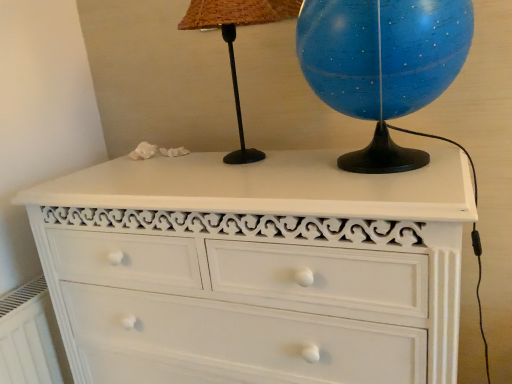
Identify the location of white painted wood chest of drawers at center. The image size is (512, 384). (255, 268).

At what (x,y) coordinates should I click in order to perform the action: click on black matte table lamp at upper center. Please return your answer as a coordinate pair (x, y). Image resolution: width=512 pixels, height=384 pixels. Looking at the image, I should click on (232, 45).

What is the approximate width of black matte table lamp at upper center?

7.16 inches.

Locate an element on the screen. This screenshot has height=384, width=512. white painted wood chest of drawers at center is located at coordinates (255, 268).

Is point (179, 28) less distant than point (440, 79)?

No, (179, 28) is behind (440, 79).

There is a blue glossy globe at upper right. Identify the location of table lamp above it (from a real-world perspective). The width and height of the screenshot is (512, 384). (232, 45).

Would you say black matte table lamp at upper center contains blue glossy globe at upper right?

No, blue glossy globe at upper right is not inside black matte table lamp at upper center.

Consider the image. From the image's perspective, which one is positioned lower, black matte table lamp at upper center or blue glossy globe at upper right?

blue glossy globe at upper right, from the image's perspective.

Between white painted wood chest of drawers at center and black matte table lamp at upper center, which one has larger size?

With larger size is white painted wood chest of drawers at center.

How many degrees apart are the facing directions of white painted wood chest of drawers at center and black matte table lamp at upper center?

0.00374 degrees.

Between white painted wood chest of drawers at center and black matte table lamp at upper center, which one has more height?

white painted wood chest of drawers at center is taller.

Considering the points (426, 344) and (221, 14), which point is behind, point (426, 344) or point (221, 14)?

Positioned behind is point (221, 14).

Considering the positions of objects blue glossy globe at upper right and white painted radiator at lower left in the image provided, who is more to the right, blue glossy globe at upper right or white painted radiator at lower left?

From the viewer's perspective, blue glossy globe at upper right appears more on the right side.

From the image's perspective, is blue glossy globe at upper right located beneath white painted radiator at lower left?

No.

Do you think blue glossy globe at upper right is within white painted radiator at lower left, or outside of it?

blue glossy globe at upper right is outside white painted radiator at lower left.

Between blue glossy globe at upper right and white painted radiator at lower left, which one has smaller size?

white painted radiator at lower left is smaller.

From the image's perspective, which one is positioned higher, white painted radiator at lower left or black matte table lamp at upper center?

black matte table lamp at upper center is shown above in the image.

Does white painted radiator at lower left turn towards black matte table lamp at upper center?

No, white painted radiator at lower left is not facing towards black matte table lamp at upper center.

Between white painted radiator at lower left and black matte table lamp at upper center, which one appears on the left side from the viewer's perspective?

From the viewer's perspective, white painted radiator at lower left appears more on the left side.

Does white painted radiator at lower left have a larger size compared to black matte table lamp at upper center?

No.

In terms of width, does blue glossy globe at upper right look wider or thinner when compared to white painted wood chest of drawers at center?

Considering their sizes, blue glossy globe at upper right looks slimmer than white painted wood chest of drawers at center.

From the image's perspective, is blue glossy globe at upper right located above white painted wood chest of drawers at center?

Yes, from the image's perspective, blue glossy globe at upper right is above white painted wood chest of drawers at center.

Can you tell me how much blue glossy globe at upper right and white painted wood chest of drawers at center differ in facing direction?

They differ by 0.000908 degrees in their facing directions.

Where is `chest of drawers in front of the blue glossy globe at upper right`? chest of drawers in front of the blue glossy globe at upper right is located at coordinates (255, 268).

Is black matte table lamp at upper center oriented away from white painted wood chest of drawers at center?

No.

Would you consider black matte table lamp at upper center to be distant from white painted wood chest of drawers at center?

No, there isn't a large distance between black matte table lamp at upper center and white painted wood chest of drawers at center.

Is black matte table lamp at upper center situated inside white painted wood chest of drawers at center or outside?

black matte table lamp at upper center is not inside white painted wood chest of drawers at center, it's outside.

How different are the orientations of black matte table lamp at upper center and white painted wood chest of drawers at center in degrees?

black matte table lamp at upper center and white painted wood chest of drawers at center are facing 0.00374 degrees away from each other.

Is black matte table lamp at upper center facing away from white painted radiator at lower left?

No.

Between black matte table lamp at upper center and white painted radiator at lower left, which one appears on the right side from the viewer's perspective?

black matte table lamp at upper center.

Who is shorter, black matte table lamp at upper center or white painted radiator at lower left?

Standing shorter between the two is white painted radiator at lower left.

Measure the distance from black matte table lamp at upper center to white painted radiator at lower left.

black matte table lamp at upper center is 27.70 inches from white painted radiator at lower left.

You are a GUI agent. You are given a task and a screenshot of the screen. Output one action in this format:
    pyautogui.click(x=<x>, y=<y>)
    Task: Click on the sphere that appears below the black matte table lamp at upper center (from the image's perspective)
    The width and height of the screenshot is (512, 384).
    Given the screenshot: What is the action you would take?
    pyautogui.click(x=382, y=65)

The width and height of the screenshot is (512, 384). I want to click on the chest of drawers beneath the black matte table lamp at upper center (from a real-world perspective), so click(255, 268).

Considering their positions, is white painted radiator at lower left positioned closer to white painted wood chest of drawers at center than black matte table lamp at upper center?

The object closer to white painted wood chest of drawers at center is black matte table lamp at upper center.

From the image, which object appears to be farther from white painted radiator at lower left, black matte table lamp at upper center or white painted wood chest of drawers at center?

The object further to white painted radiator at lower left is black matte table lamp at upper center.

When comparing their distances from black matte table lamp at upper center, does white painted radiator at lower left or white painted wood chest of drawers at center seem further?

white painted radiator at lower left.

Looking at the image, which one is located closer to white painted wood chest of drawers at center, white painted radiator at lower left or blue glossy globe at upper right?

Among the two, blue glossy globe at upper right is located nearer to white painted wood chest of drawers at center.

Looking at the image, which one is located closer to white painted radiator at lower left, white painted wood chest of drawers at center or black matte table lamp at upper center?

Based on the image, white painted wood chest of drawers at center appears to be nearer to white painted radiator at lower left.

Based on their spatial positions, is white painted wood chest of drawers at center or blue glossy globe at upper right closer to black matte table lamp at upper center?

Among the two, blue glossy globe at upper right is located nearer to black matte table lamp at upper center.

Considering their positions, is white painted radiator at lower left positioned closer to blue glossy globe at upper right than white painted wood chest of drawers at center?

Among the two, white painted wood chest of drawers at center is located nearer to blue glossy globe at upper right.

Based on their spatial positions, is black matte table lamp at upper center or white painted radiator at lower left further from blue glossy globe at upper right?

The object further to blue glossy globe at upper right is white painted radiator at lower left.

Find the location of `the chest of drawers between black matte table lamp at upper center and white painted radiator at lower left vertically`. the chest of drawers between black matte table lamp at upper center and white painted radiator at lower left vertically is located at coordinates (255, 268).

Where is `sphere between black matte table lamp at upper center and white painted wood chest of drawers at center in the vertical direction`? This screenshot has height=384, width=512. sphere between black matte table lamp at upper center and white painted wood chest of drawers at center in the vertical direction is located at coordinates (382, 65).

I want to click on chest of drawers between white painted radiator at lower left and blue glossy globe at upper right, so click(255, 268).

Identify the location of table lamp located between white painted radiator at lower left and blue glossy globe at upper right in the left-right direction. (232, 45).